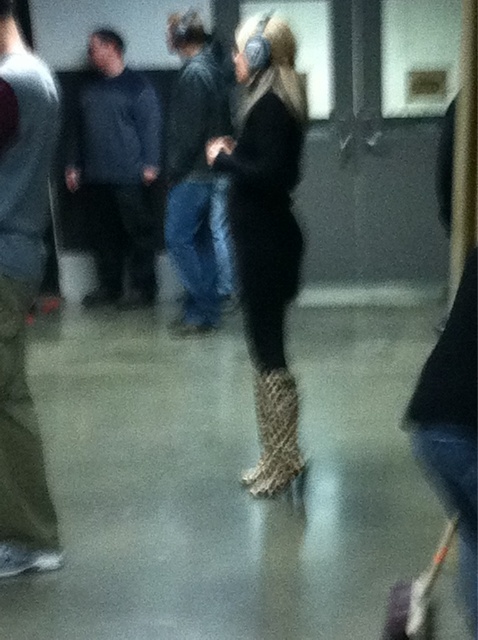
Question: Which point is farther from the camera taking this photo?

Choices:
 (A) (285, 371)
 (B) (294, 289)
 (C) (195, 192)
 (D) (24, 476)

Answer: (C)

Question: From the image, what is the correct spatial relationship of leather jacket at center in relation to leopard print boot at center?

Choices:
 (A) right
 (B) left

Answer: (B)

Question: Based on their relative distances, which object is farther from the leopard print boots at center?

Choices:
 (A) leather jacket at center
 (B) dark blue jeans at left
 (C) dark blue jacket at left

Answer: (C)

Question: Can you confirm if dark blue jeans at left is bigger than dark blue jacket at left?

Choices:
 (A) yes
 (B) no

Answer: (B)

Question: Where is leopard print boots at center located in relation to dark blue jacket at left in the image?

Choices:
 (A) right
 (B) left

Answer: (A)

Question: Which of the following is the farthest from the observer?

Choices:
 (A) (286, 474)
 (B) (2, 324)

Answer: (A)